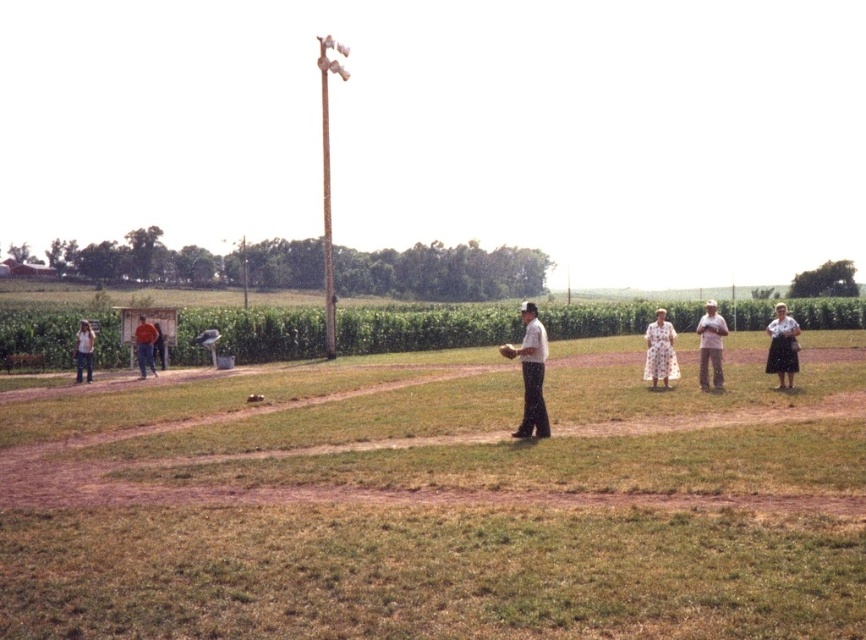
Is the position of white dotted dress at center more distant than that of light brown wooden baseball bat at left?

No, white dotted dress at center is in front of light brown wooden baseball bat at left.

Does white dotted dress at center appear on the right side of light brown wooden baseball bat at left?

Correct, you'll find white dotted dress at center to the right of light brown wooden baseball bat at left.

You are a GUI agent. You are given a task and a screenshot of the screen. Output one action in this format:
    pyautogui.click(x=<x>, y=<y>)
    Task: Click on the white dotted dress at center
    The image size is (866, 640).
    Given the screenshot: What is the action you would take?
    pyautogui.click(x=660, y=352)

Between white cotton dress at right and orange shirt at left, which one is positioned higher?

white cotton dress at right is above.

What are the coordinates of `white cotton dress at right` in the screenshot? It's located at (782, 346).

Does point (776, 326) come in front of point (152, 340)?

Yes.

The image size is (866, 640). Find the location of `white cotton dress at right`. white cotton dress at right is located at coordinates (782, 346).

Can you confirm if orange fabric shirt at left is positioned to the right of brown leather glove at center?

No, orange fabric shirt at left is not to the right of brown leather glove at center.

Is orange fabric shirt at left taller than brown leather glove at center?

Yes, orange fabric shirt at left is taller than brown leather glove at center.

What do you see at coordinates (159, 346) in the screenshot? I see `orange fabric shirt at left` at bounding box center [159, 346].

This screenshot has height=640, width=866. Find the location of `orange fabric shirt at left`. orange fabric shirt at left is located at coordinates (159, 346).